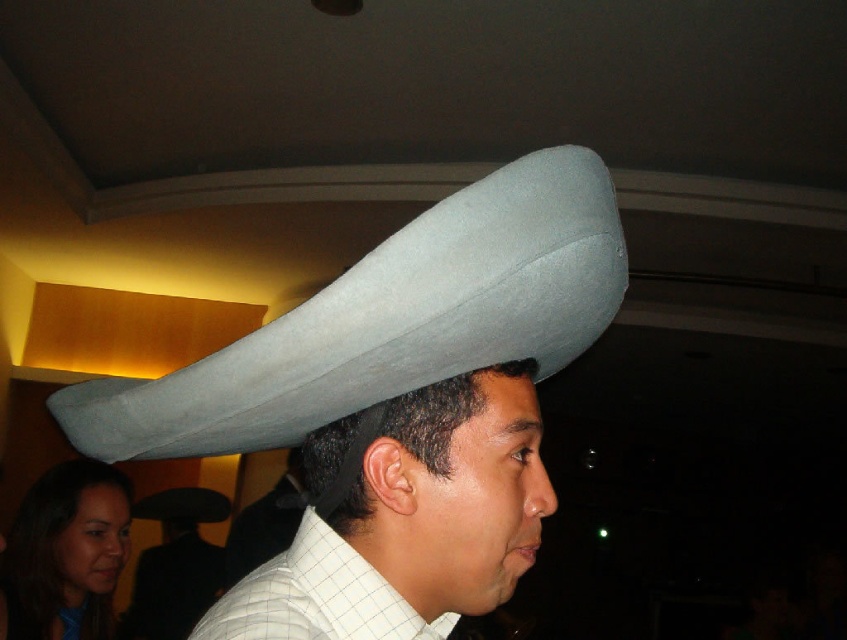
You are a fashion designer observing the scene. You need to decide which item has a smaller width between the white checkered shirt at center and the gray felt hat at upper center. Which one is it?

The white checkered shirt at center has a smaller width compared to the gray felt hat at upper center.

You are a photographer trying to capture a clear shot of the person wearing the white felt hat at upper center and the gray felt hat at upper center. Since you want to focus on the larger hat, which one should you zoom in on?

The white felt hat at upper center is larger in size than the gray felt hat at upper center, so you should zoom in on the white felt hat at upper center.

You are standing in a restaurant and want to place a small decoration exactly at the point labeled as point (333, 545). Given that the decoration requires 12 inches of space in front to be safely placed, will the space be sufficient?

The point (333, 545) is 18.45 inches from the viewer, which is more than the required 12 inches, so the space is sufficient for placing the decoration.